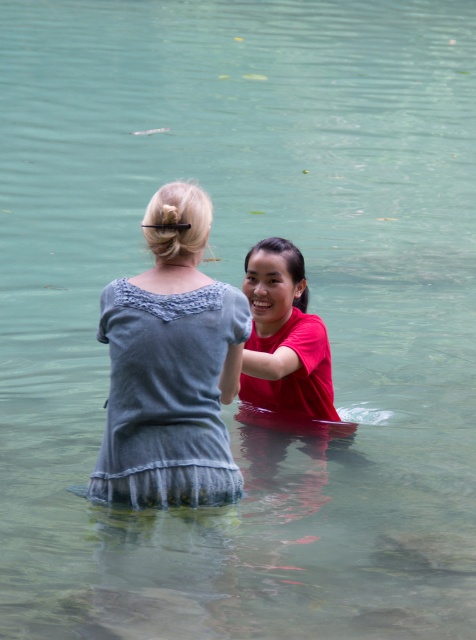
Question: Can you confirm if denim dress at center is bigger than red matte shirt at center?

Choices:
 (A) no
 (B) yes

Answer: (A)

Question: Is denim dress at center bigger than red matte shirt at center?

Choices:
 (A) no
 (B) yes

Answer: (A)

Question: Which point appears farthest from the camera in this image?

Choices:
 (A) (269, 241)
 (B) (211, 310)

Answer: (A)

Question: Which of the following is the closest to the observer?

Choices:
 (A) (275, 380)
 (B) (122, 381)

Answer: (B)

Question: Can you confirm if denim dress at center is bigger than red matte shirt at center?

Choices:
 (A) no
 (B) yes

Answer: (A)